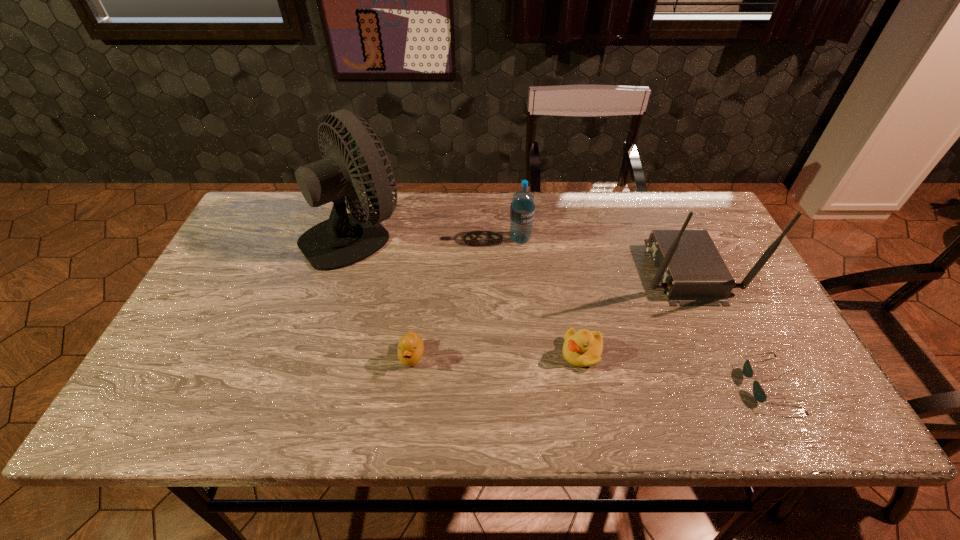
You are a GUI agent. You are given a task and a screenshot of the screen. Output one action in this format:
    pyautogui.click(x=<x>, y=<y>)
    Task: Click on the vacant region at the left edge of the desktop
    
    Given the screenshot: What is the action you would take?
    pyautogui.click(x=246, y=254)

Locate an element on the screen. Image resolution: width=960 pixels, height=540 pixels. free space at the right edge of the desktop is located at coordinates (744, 325).

This screenshot has height=540, width=960. Find the location of `free location at the near left corner of the desktop`. free location at the near left corner of the desktop is located at coordinates (184, 399).

Where is `free space between the third tallest object and the fifth shortest object`? Image resolution: width=960 pixels, height=540 pixels. free space between the third tallest object and the fifth shortest object is located at coordinates (602, 255).

In order to click on vacant area that lies between the tallest object and the right duckling in this screenshot , I will do `click(468, 293)`.

Find the location of a particular element. free space that is in between the router and the third object from left to right is located at coordinates (602, 255).

The width and height of the screenshot is (960, 540). Identify the location of free space between the router and the tallest object. tap(519, 252).

Identify the location of vacant space that is in between the fan and the fifth object from right to left. (384, 295).

This screenshot has height=540, width=960. I want to click on free space between the third object from right to left and the shortest object, so click(x=675, y=369).

The height and width of the screenshot is (540, 960). I want to click on vacant area that lies between the sunglasses and the router, so click(727, 328).